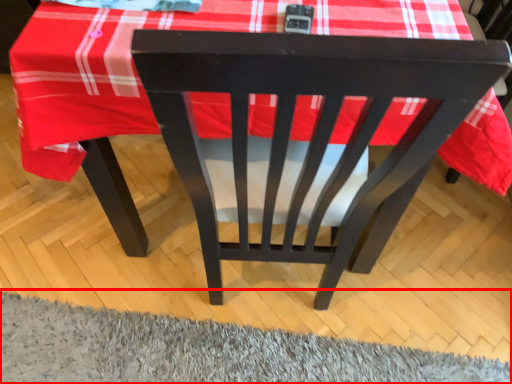
Question: From the image's perspective, what is the correct spatial positioning of mat (annotated by the red box) in reference to chair?

Choices:
 (A) above
 (B) below

Answer: (B)